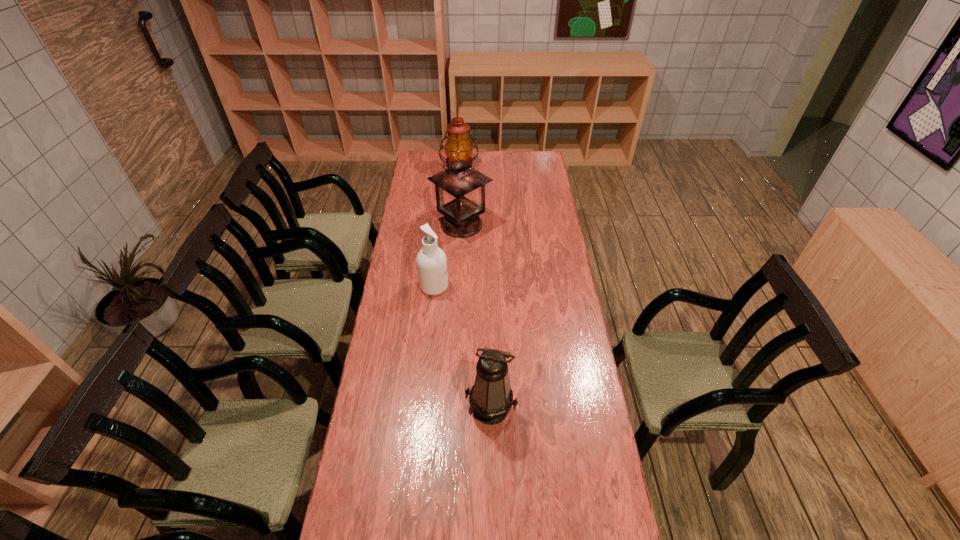
Locate which oil lamp is the second closest to the second farthest object. Please provide its 2D coordinates. Your answer should be formatted as a tuple, i.e. [(x, y)], where the tuple contains the x and y coordinates of a point satisfying the conditions above.

[(491, 397)]

Where is `oil lamp identified as the closest to the nearest object`? This screenshot has height=540, width=960. oil lamp identified as the closest to the nearest object is located at coordinates 460,190.